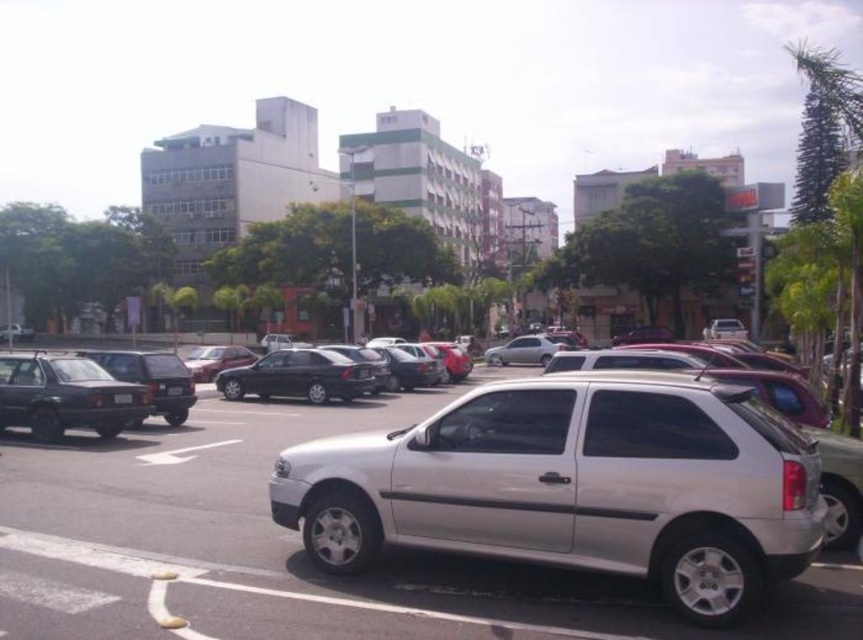
You are a delivery driver who needs to deliver a package to a customer. You see the silver metallic hatchback at center and the black plastic license plate at center. Which object is nearer to you?

The silver metallic hatchback at center is closer to the viewer than the black plastic license plate at center, so the silver metallic hatchback at center is nearer to you.

You are a delivery driver trying to park your shiny silver sedan at center in a tight space between two other cars. The space is only 2 meters wide. Can you fit your car if the satin black sedan at center is parked to your right?

The satin black sedan at center is to the right of the shiny silver sedan at center, so the shiny silver sedan at center can fit in the 2 meter space as long as the distance between the two cars allows for the width of your vehicle.